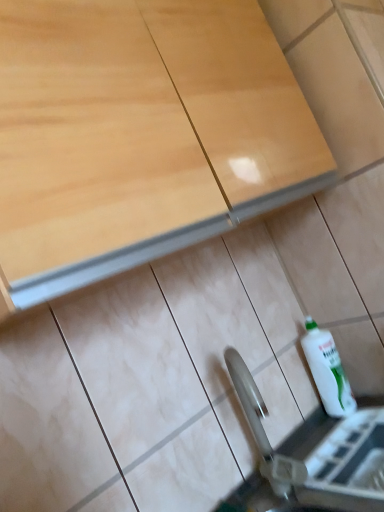
This screenshot has height=512, width=384. Identify the location of vacant region in front of white glossy bottle at lower right. (350, 430).